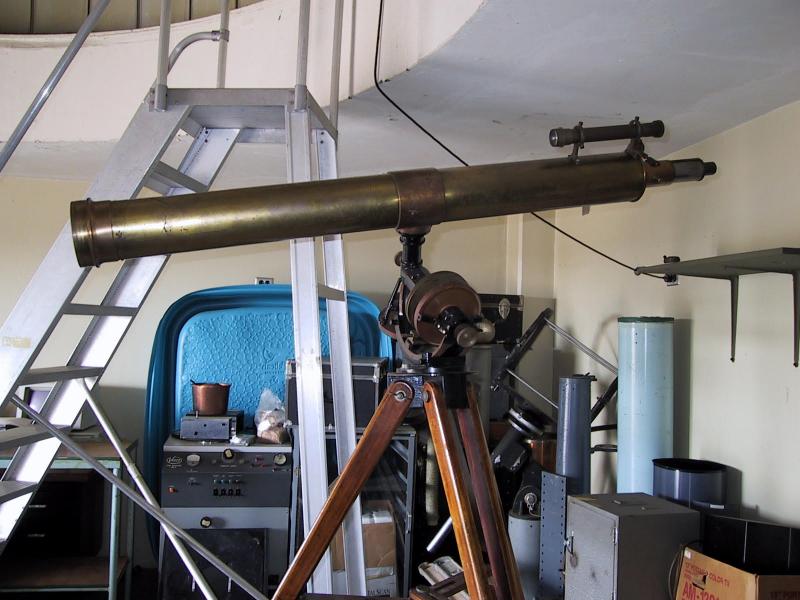
Identify the location of ladder stair. (18, 351).